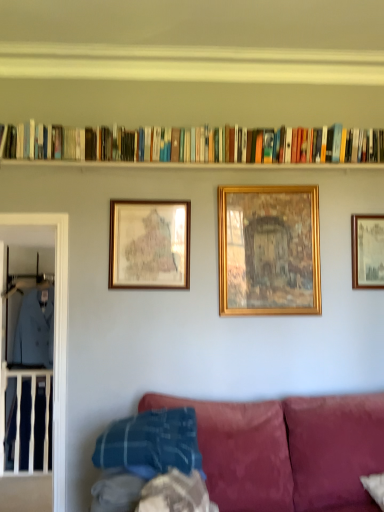
Question: Can you confirm if hardcover books at upper center is shorter than clear glass door at left?

Choices:
 (A) yes
 (B) no

Answer: (A)

Question: Can you see hardcover books at upper center touching clear glass door at left?

Choices:
 (A) no
 (B) yes

Answer: (A)

Question: Are hardcover books at upper center and clear glass door at left far apart?

Choices:
 (A) yes
 (B) no

Answer: (A)

Question: Considering the relative sizes of hardcover books at upper center and clear glass door at left in the image provided, is hardcover books at upper center smaller than clear glass door at left?

Choices:
 (A) yes
 (B) no

Answer: (A)

Question: From a real-world perspective, does hardcover books at upper center stand above clear glass door at left?

Choices:
 (A) no
 (B) yes

Answer: (B)

Question: Relative to gold-framed map at center-left, positioned as the first picture frame in left-to-right order, is light blue fabric at left, acting as the first clothing starting from the left, in front or behind?

Choices:
 (A) front
 (B) behind

Answer: (B)

Question: Looking at the image, does light blue fabric at left, acting as the first clothing starting from the left, seem bigger or smaller compared to gold-framed map at center-left, positioned as the first picture frame in left-to-right order?

Choices:
 (A) small
 (B) big

Answer: (B)

Question: Would you say light blue fabric at left, which is the 2th clothing in right-to-left order, is inside or outside gold-framed map at center-left, arranged as the third picture frame when viewed from the right?

Choices:
 (A) inside
 (B) outside

Answer: (B)

Question: From the image's perspective, is light blue fabric at left, which is the 2th clothing in right-to-left order, located above or below gold-framed map at center-left, positioned as the first picture frame in left-to-right order?

Choices:
 (A) below
 (B) above

Answer: (A)

Question: Which is correct: gold-framed map at center-left, arranged as the third picture frame when viewed from the right, is inside hardcover books at upper center, or outside of it?

Choices:
 (A) outside
 (B) inside

Answer: (A)

Question: From the image's perspective, is gold-framed map at center-left, arranged as the third picture frame when viewed from the right, positioned above or below hardcover books at upper center?

Choices:
 (A) below
 (B) above

Answer: (A)

Question: Is gold-framed map at center-left, arranged as the third picture frame when viewed from the right, taller or shorter than hardcover books at upper center?

Choices:
 (A) tall
 (B) short

Answer: (A)

Question: Is gold-framed map at center-left, arranged as the third picture frame when viewed from the right, in front of or behind hardcover books at upper center in the image?

Choices:
 (A) front
 (B) behind

Answer: (B)

Question: Considering the positions of gold-framed map at center-left, arranged as the third picture frame when viewed from the right, and light blue fabric at left, arranged as the 1th clothing when viewed from the right, in the image, is gold-framed map at center-left, arranged as the third picture frame when viewed from the right, bigger or smaller than light blue fabric at left, arranged as the 1th clothing when viewed from the right,?

Choices:
 (A) big
 (B) small

Answer: (B)

Question: In the image, is gold-framed map at center-left, arranged as the third picture frame when viewed from the right, positioned in front of or behind light blue fabric at left, arranged as the 1th clothing when viewed from the right?

Choices:
 (A) front
 (B) behind

Answer: (A)